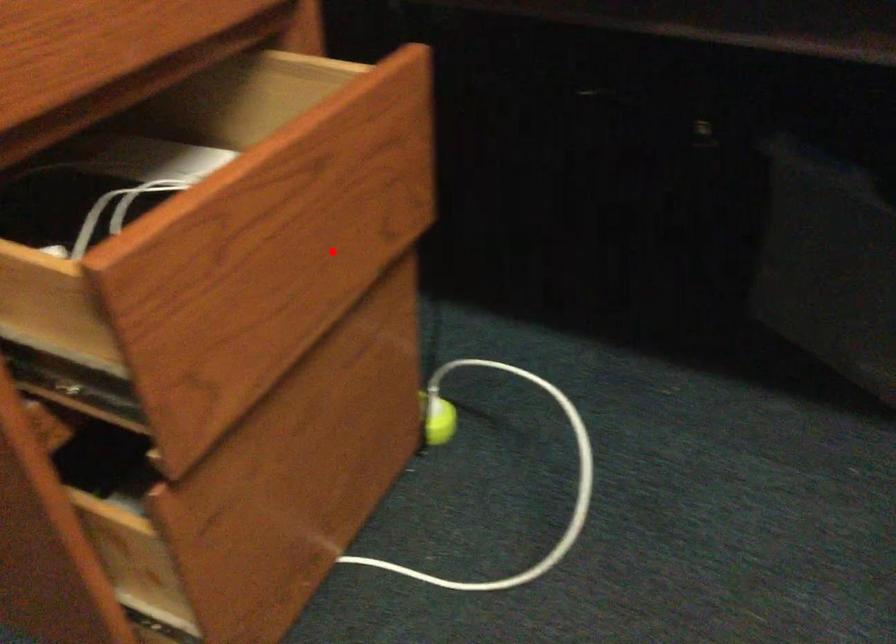
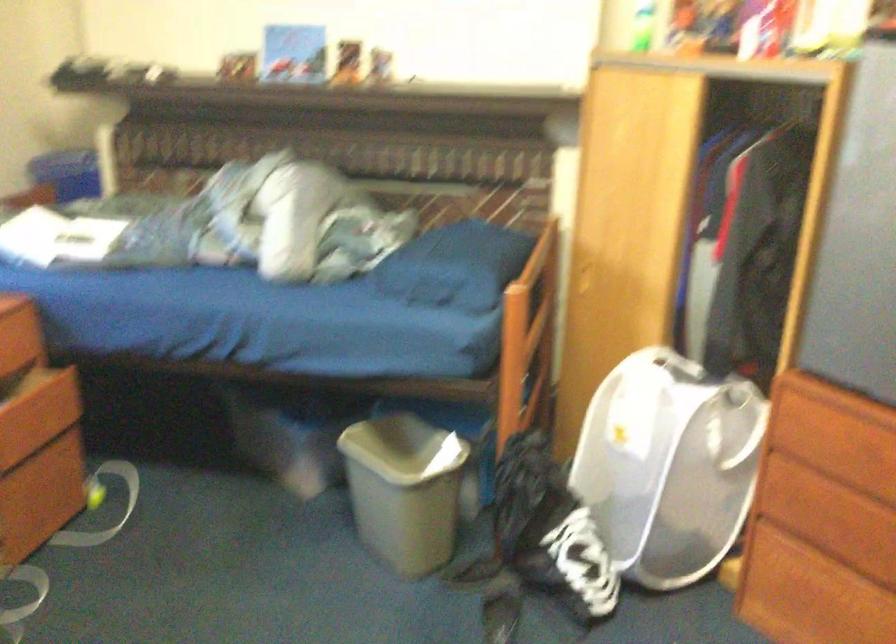
Question: I am providing you with two images of the same scene from different viewpoints. In image1, a red point is highlighted. Considering the same 3D point in image2, which of the following is correct?

Choices:
 (A) It is closer
 (B) It is farther

Answer: (B)